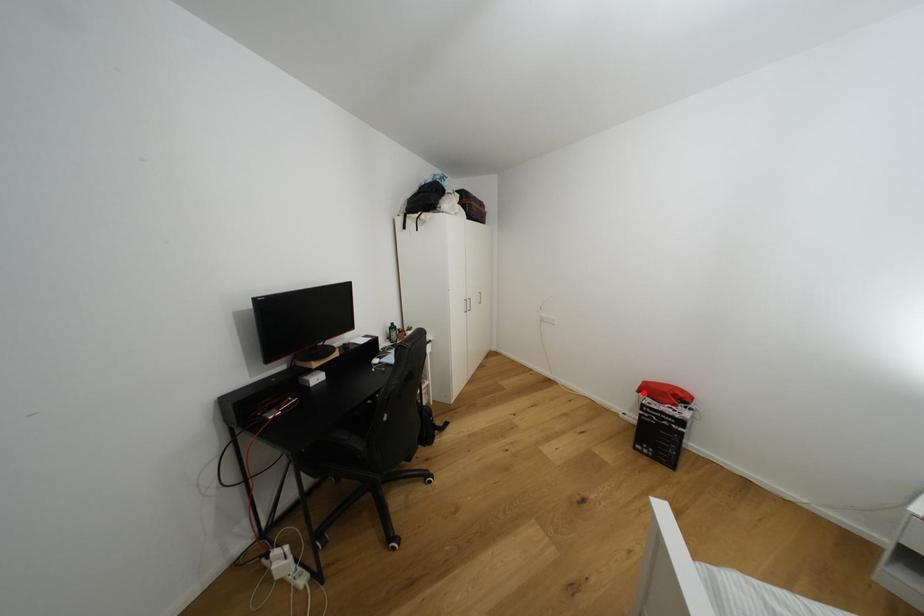
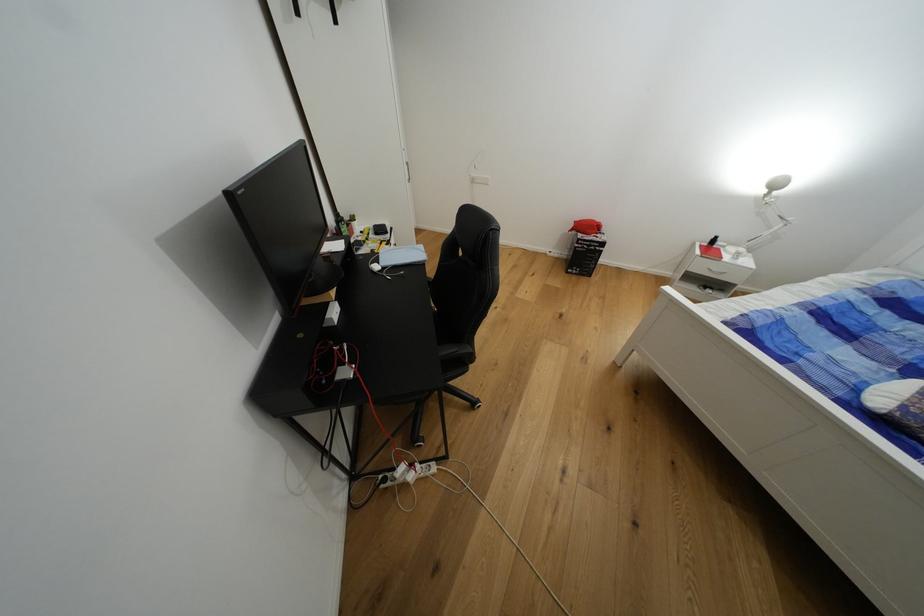
Question: I am providing you with two images of the same scene from different viewpoints. Image1 has a red point marked. In image2, the corresponding 3D location appears at what relative position? Reply with the corresponding letter.

Choices:
 (A) Closer
 (B) Farther

Answer: (A)